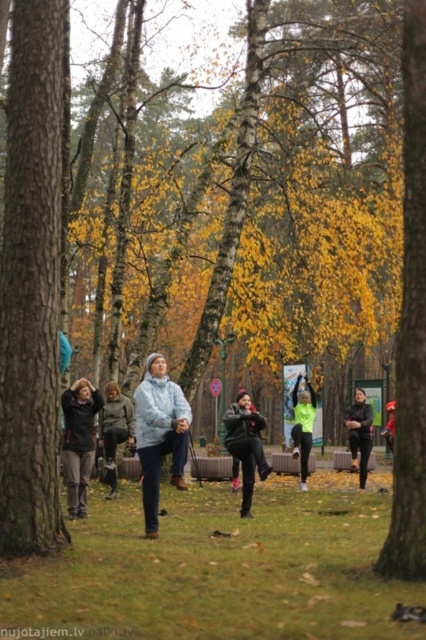
Question: Is matte gray jacket at center further to camera compared to black matte jacket at center?

Choices:
 (A) no
 (B) yes

Answer: (A)

Question: In this image, where is yellow leafy tree at right located relative to matte black jacket at center?

Choices:
 (A) right
 (B) left

Answer: (A)

Question: Does matte gray jacket at left have a lesser width compared to neon green fabric at center?

Choices:
 (A) yes
 (B) no

Answer: (B)

Question: Which point is closer to the camera taking this photo?

Choices:
 (A) (22, 474)
 (B) (78, 516)

Answer: (A)

Question: Which is nearer to the neon green fabric at center?

Choices:
 (A) dark gray sweater at center
 (B) orange helmet at center
 (C) matte black jacket at center

Answer: (B)

Question: Which is farther from the matte gray jacket at left?

Choices:
 (A) black matte jacket at center
 (B) matte gray jacket at center
 (C) dark gray sweater at center
 (D) orange helmet at center

Answer: (D)